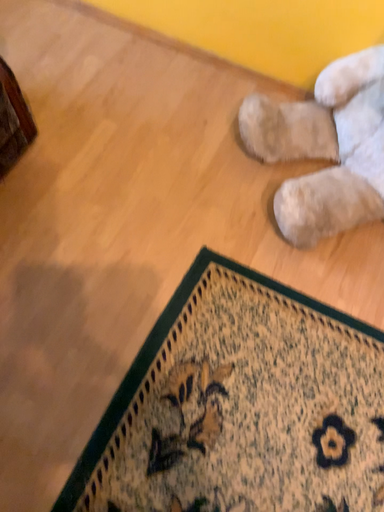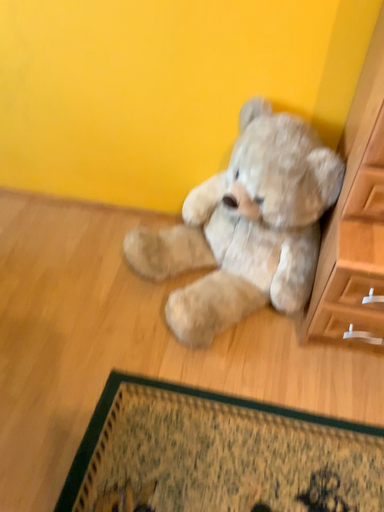
Question: Which way did the camera rotate in the video?

Choices:
 (A) rotated downward
 (B) rotated upward

Answer: (B)